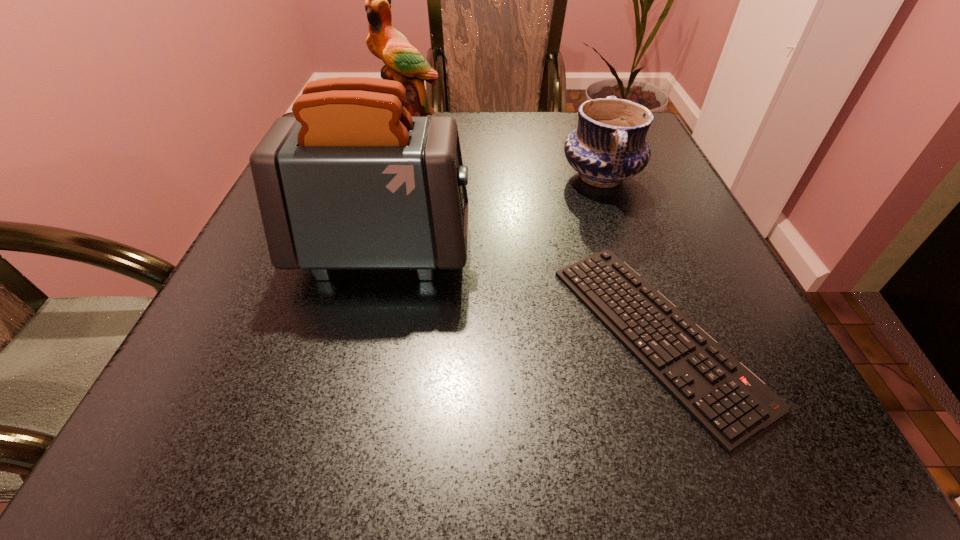
The width and height of the screenshot is (960, 540). I want to click on parrot, so click(404, 63).

This screenshot has height=540, width=960. I want to click on toaster, so click(x=352, y=182).

You are a GUI agent. You are given a task and a screenshot of the screen. Output one action in this format:
    pyautogui.click(x=<x>, y=<y>)
    Task: Click on the third nearest object
    This screenshot has width=960, height=540.
    Given the screenshot: What is the action you would take?
    pyautogui.click(x=608, y=146)

In order to click on the third tallest object in this screenshot , I will do `click(608, 146)`.

Find the location of a particular element. The width and height of the screenshot is (960, 540). computer keyboard is located at coordinates (731, 403).

The image size is (960, 540). What are the coordinates of `vacant space located on the front-facing side of the farthest object` in the screenshot? It's located at (382, 234).

Image resolution: width=960 pixels, height=540 pixels. What are the coordinates of `free space located 0.110m on the front-facing side of the toaster` in the screenshot? It's located at pos(529,251).

Identify the location of free space located on the left of the pottery. The height and width of the screenshot is (540, 960). (481, 176).

Identify the location of vacant space situated 0.320m on the back of the shortest object. (595, 162).

The height and width of the screenshot is (540, 960). Identify the location of parrot located in the far edge section of the desktop. (404, 63).